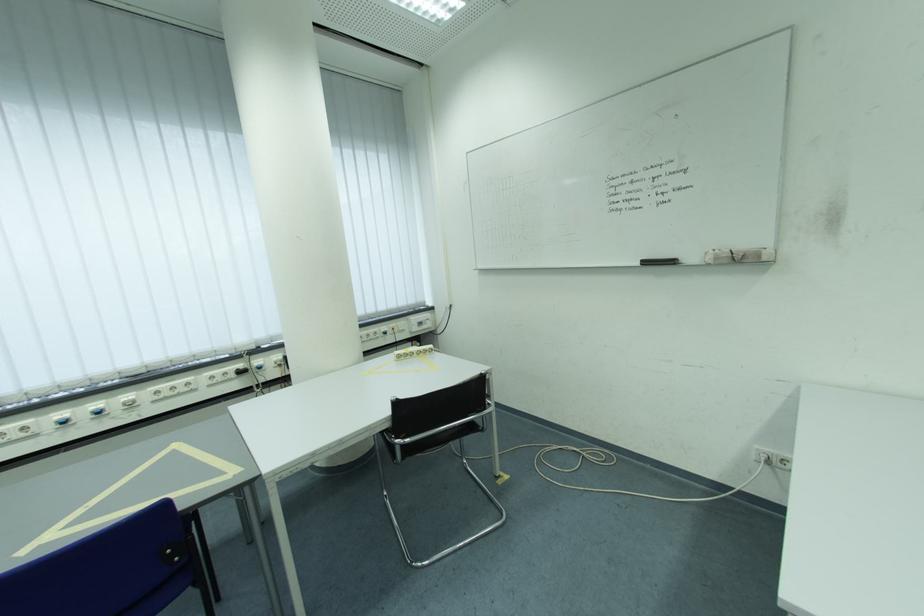
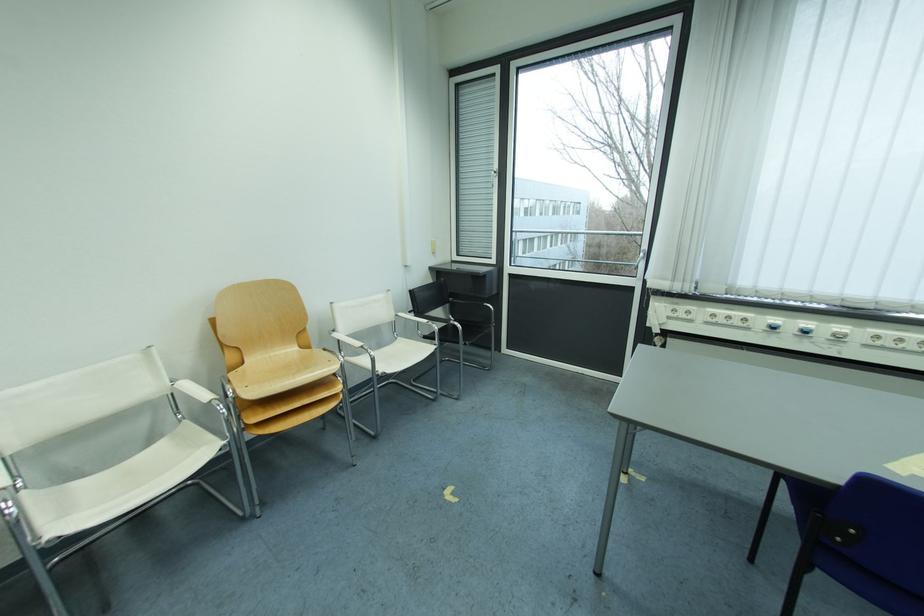
Where in the second image is the point corresponding to [104,407] from the first image?

(816, 326)